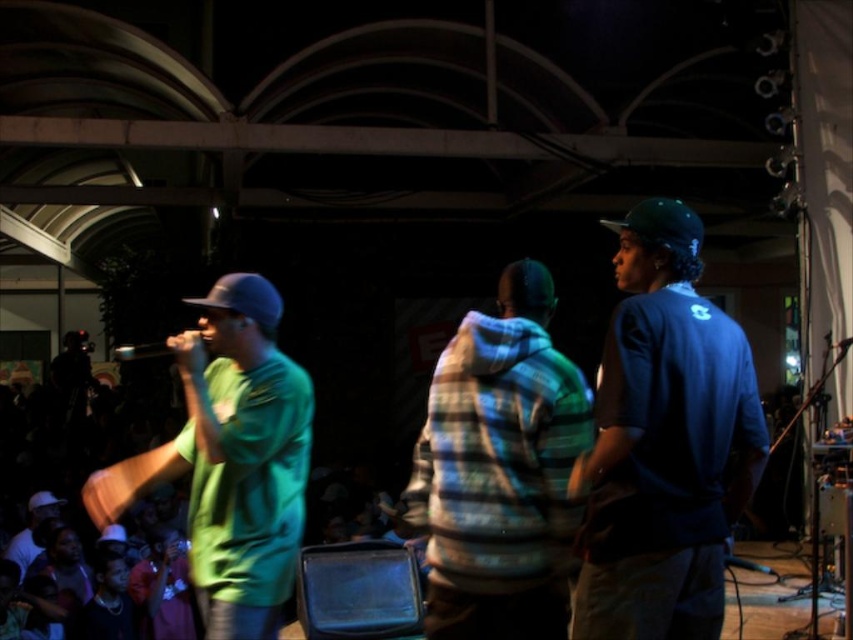
Consider the image. You are a photographer at the event and want to capture a photo where both the blue matte shirt at center and the green matte shirt at center are visible. Based on their sizes, which shirt should you focus on to ensure both are in frame without cropping?

The blue matte shirt at center has a lesser width compared to the green matte shirt at center, so focusing on the larger green matte shirt at center would allow both shirts to fit within the frame without cropping.

You are a photographer at the event and need to capture a group photo of the blue matte shirt at center and the green matte shirt at center. Your camera has a maximum focus range of 1.5 meters. Will you be able to fit both subjects within the camera frame without moving closer?

The blue matte shirt at center and green matte shirt at center are 1.24 meters apart. Since the distance between them is within the camera maximum focus range of 1.5 meters, you can fit both subjects in the frame without moving closer.